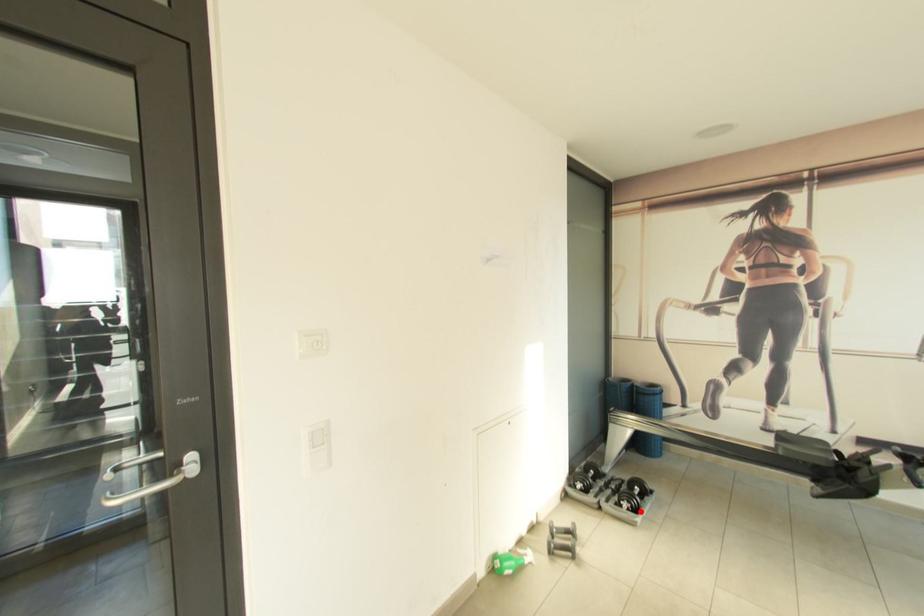
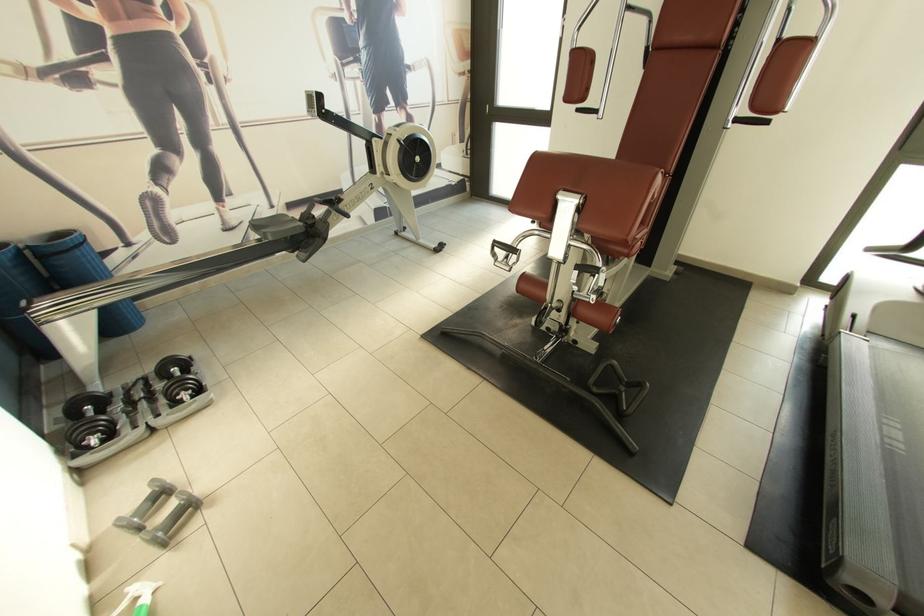
Question: A red point is marked in image1. In image2, is the corresponding 3D point closer to the camera or farther? Reply with the corresponding letter.

Choices:
 (A) The corresponding 3D point is closer.
 (B) The corresponding 3D point is farther.

Answer: (A)